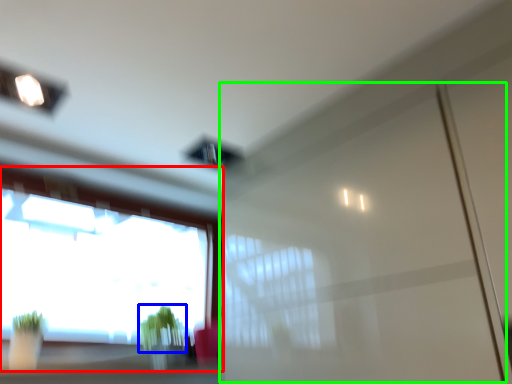
Question: Which object is positioned farthest from window (highlighted by a red box)? Select from plant (highlighted by a blue box) and screen door (highlighted by a green box).

Choices:
 (A) plant
 (B) screen door

Answer: (B)